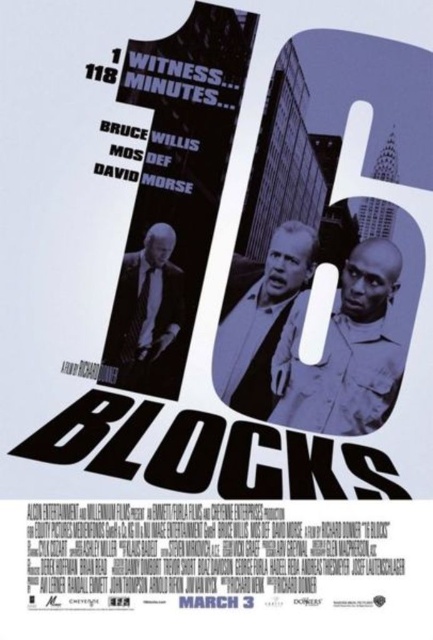
Between point (239, 387) and point (151, 369), which one is positioned in front?

Point (151, 369) is in front.

Find the location of a particular element. The image size is (433, 640). gray matte suit at center is located at coordinates (262, 321).

Which is above, matte black shirt at center or matte black suit at lower left?

matte black suit at lower left is higher up.

Consider the image. Can you confirm if matte black shirt at center is positioned above matte black suit at lower left?

No, matte black shirt at center is not above matte black suit at lower left.

Describe the element at coordinates (345, 353) in the screenshot. This screenshot has width=433, height=640. I see `matte black shirt at center` at that location.

Identify the location of matte black shirt at center. (345, 353).

Can you confirm if matte black shirt at center is smaller than gray matte suit at center?

No, matte black shirt at center is not smaller than gray matte suit at center.

Locate an element on the screen. matte black shirt at center is located at coordinates (345, 353).

What are the coordinates of `matte black shirt at center` in the screenshot? It's located at (345, 353).